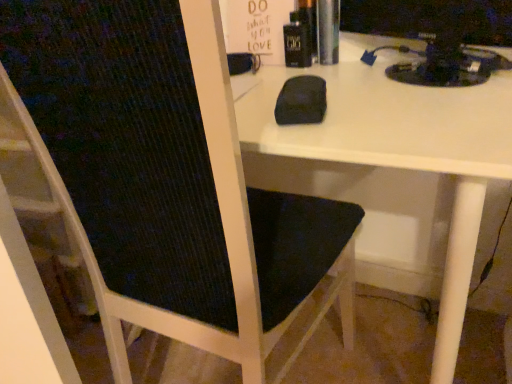
Question: Is black plastic monitor at upper right bigger or smaller than black fabric chair at center?

Choices:
 (A) small
 (B) big

Answer: (A)

Question: In terms of height, does black plastic monitor at upper right look taller or shorter compared to black fabric chair at center?

Choices:
 (A) tall
 (B) short

Answer: (B)

Question: From the image's perspective, is black plastic monitor at upper right positioned above or below black fabric chair at center?

Choices:
 (A) above
 (B) below

Answer: (A)

Question: From the image's perspective, relative to black plastic monitor at upper right, is black fabric chair at center above or below?

Choices:
 (A) above
 (B) below

Answer: (B)

Question: From a real-world perspective, relative to black plastic monitor at upper right, is black fabric chair at center vertically above or below?

Choices:
 (A) below
 (B) above

Answer: (A)

Question: Which is correct: black fabric chair at center is inside black plastic monitor at upper right, or outside of it?

Choices:
 (A) inside
 (B) outside

Answer: (B)

Question: Considering the positions of point (289, 289) and point (500, 23), is point (289, 289) closer or farther from the camera than point (500, 23)?

Choices:
 (A) farther
 (B) closer

Answer: (B)